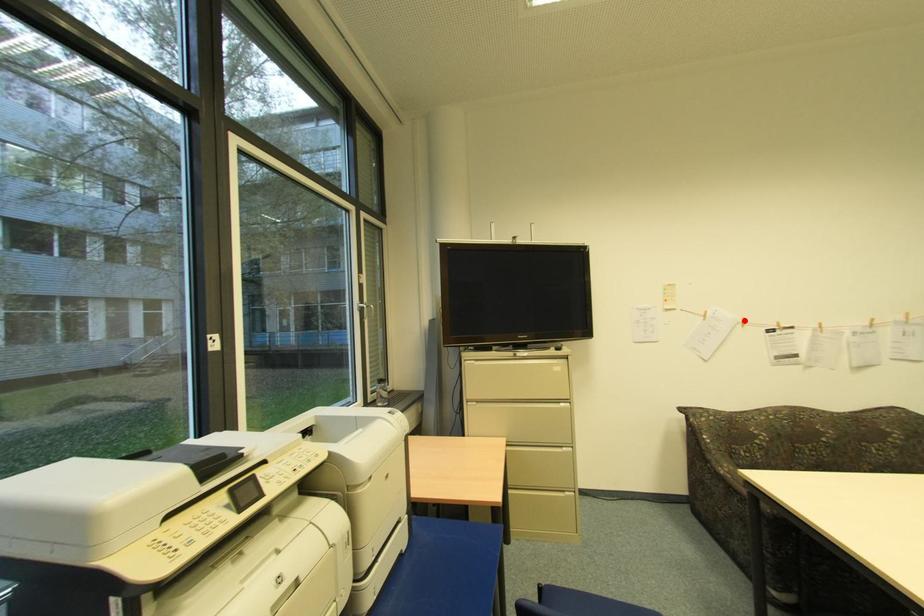
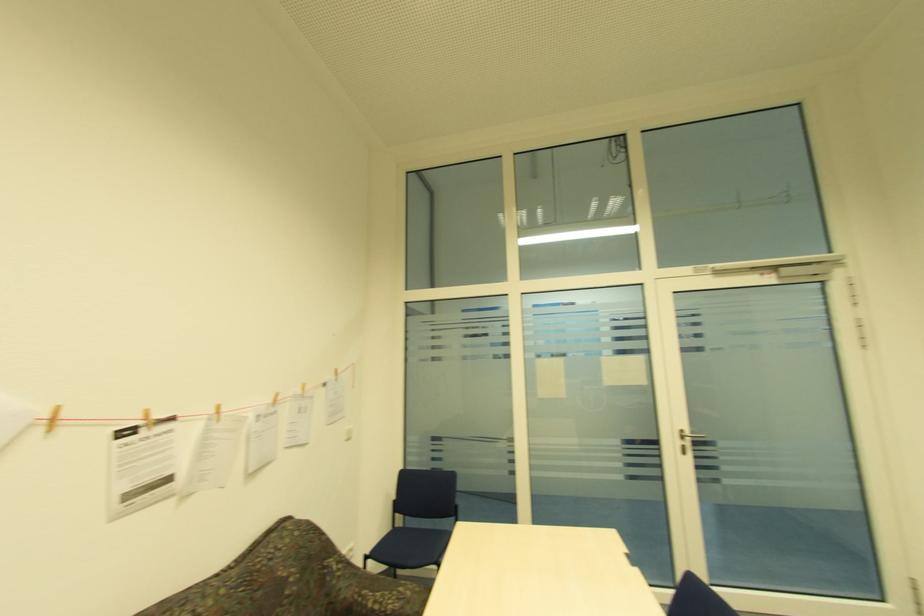
In the second image, find the point that corresponds to the highlighted location in the first image.

(49, 416)